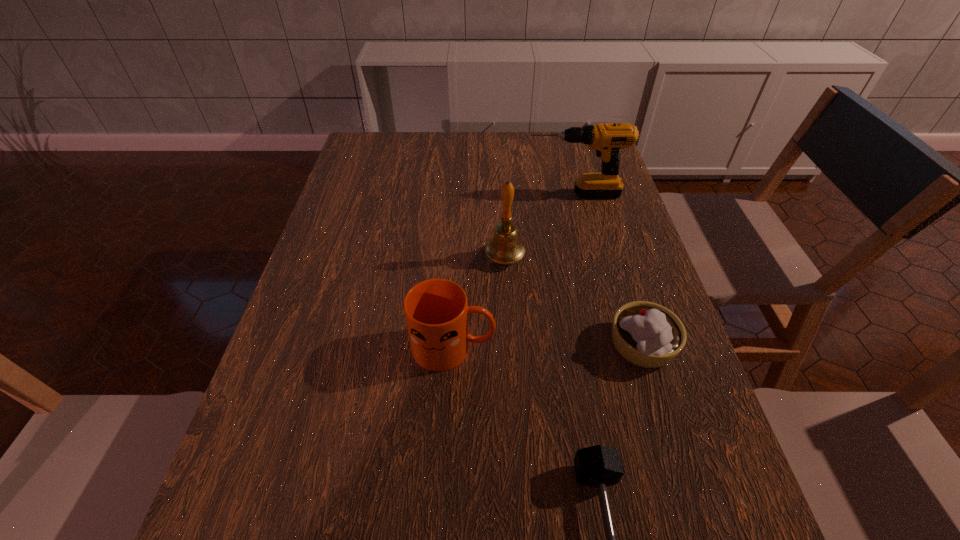
At what (x,y) coordinates should I click in order to perform the action: click on blank region between the mug and the bell. Please return your answer as a coordinate pair (x, y). Looking at the image, I should click on (479, 302).

Locate an element on the screen. Image resolution: width=960 pixels, height=540 pixels. free space between the farthest object and the second farthest object is located at coordinates (540, 226).

Image resolution: width=960 pixels, height=540 pixels. I want to click on vacant area between the fourth tallest object and the bell, so click(x=573, y=301).

This screenshot has width=960, height=540. I want to click on free space that is in between the drill and the whipped cream, so click(608, 269).

Where is `free point between the second shortest object and the drill`? free point between the second shortest object and the drill is located at coordinates (608, 269).

Locate an element on the screen. the second closest object to the mug is located at coordinates (598, 466).

This screenshot has height=540, width=960. Identify the location of the closest object to the mug. (505, 248).

Find the location of a particular element. free location that satisfies the following two spatial constraints: 1. on the front side of the bell; 2. on the right side of the whipped cream is located at coordinates (510, 345).

This screenshot has width=960, height=540. In order to click on free space that satisfies the following two spatial constraints: 1. at the tip of the farthest object; 2. on the front side of the bell in this screenshot , I will do `click(589, 258)`.